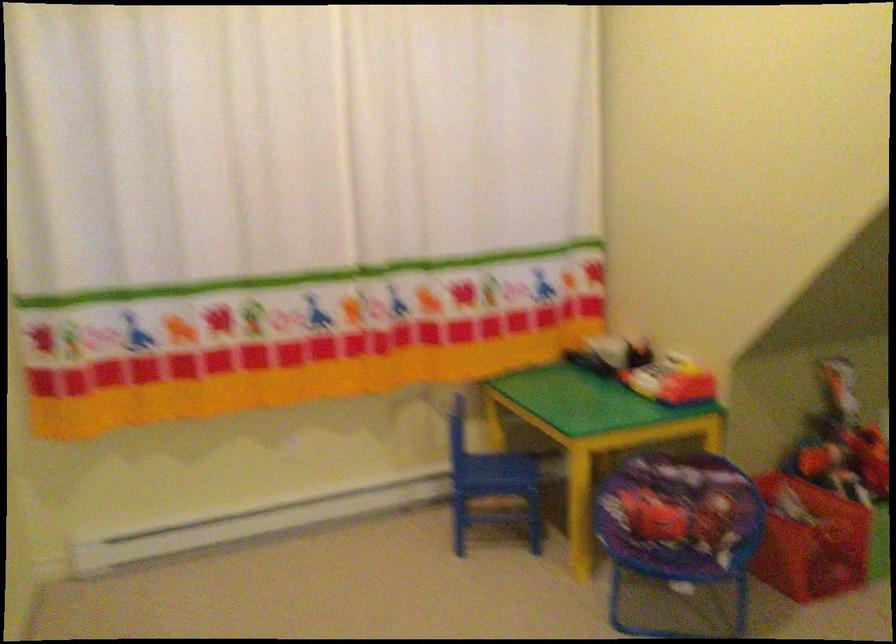
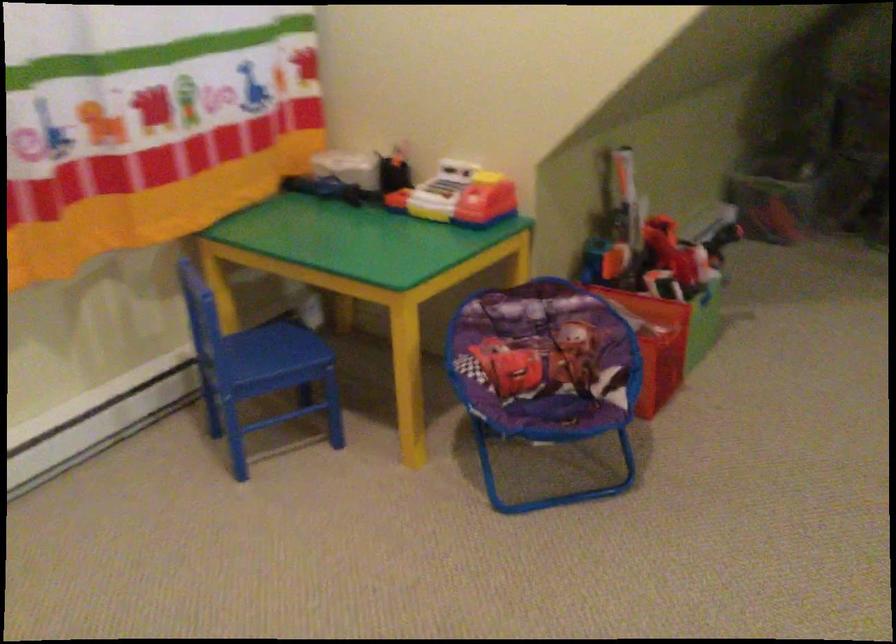
The point at (501, 469) is marked in the first image. Where is the corresponding point in the second image?

(274, 348)